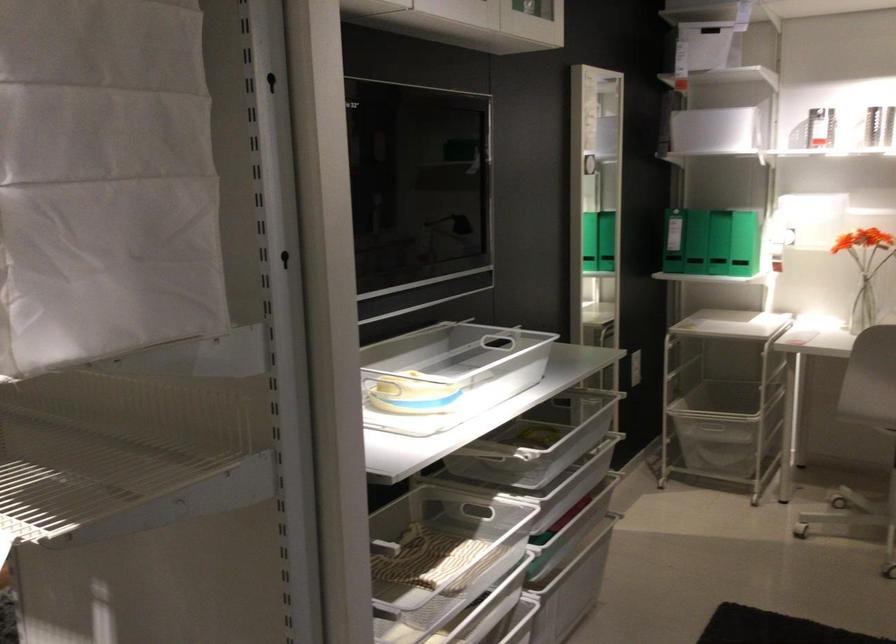
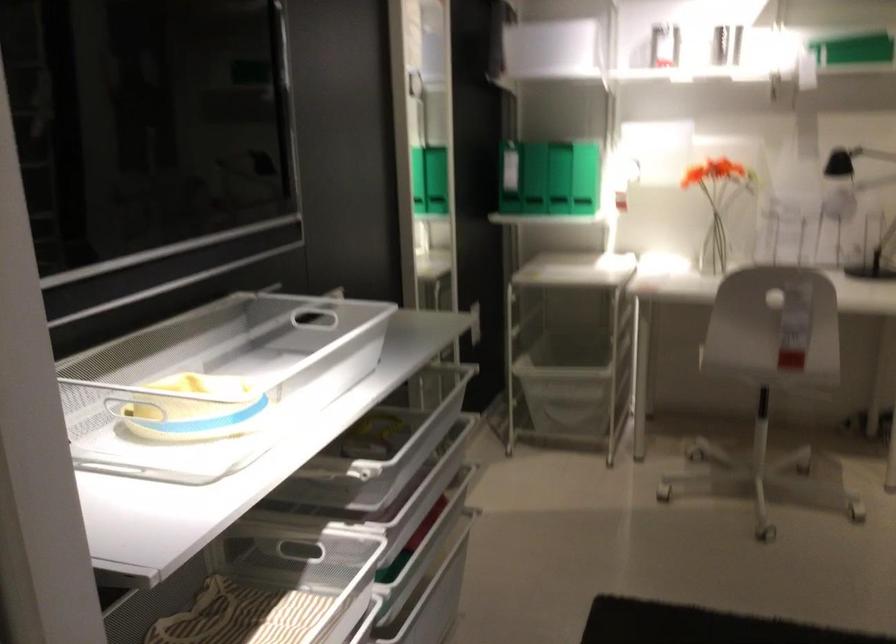
Find the pixel in the second image that matches (734,120) in the first image.

(556, 46)